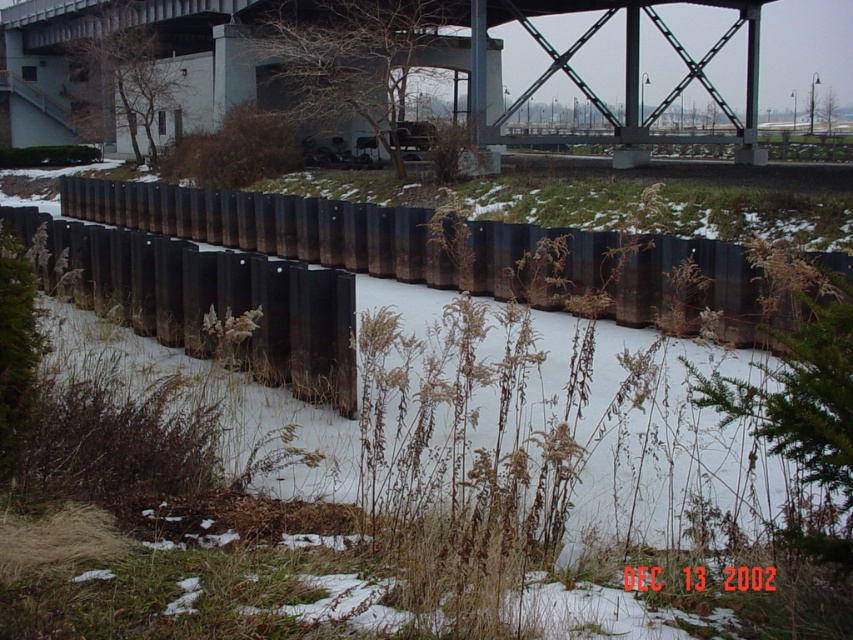
Question: Does rusty metal fence at center have a smaller size compared to metallic gray bridge at upper center?

Choices:
 (A) no
 (B) yes

Answer: (B)

Question: Which point is closer to the camera?

Choices:
 (A) rusty metal fence at center
 (B) metallic gray bridge at upper center

Answer: (A)

Question: Which of the following is the farthest from the observer?

Choices:
 (A) (466, 45)
 (B) (102, 225)

Answer: (A)

Question: Is rusty metal fence at center to the right of metallic gray bridge at upper center from the viewer's perspective?

Choices:
 (A) no
 (B) yes

Answer: (A)

Question: Can you confirm if rusty metal fence at center is positioned to the right of metallic gray bridge at upper center?

Choices:
 (A) no
 (B) yes

Answer: (A)